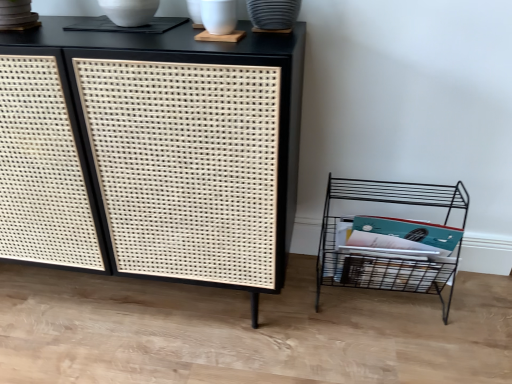
The height and width of the screenshot is (384, 512). What do you see at coordinates (381, 257) in the screenshot?
I see `black wire shelf at lower right` at bounding box center [381, 257].

Identify the location of black wire shelf at lower right. (381, 257).

Describe the element at coordinates (185, 148) in the screenshot. I see `black woven cabinet at center` at that location.

Identify the location of black woven cabinet at center. The height and width of the screenshot is (384, 512). (185, 148).

In order to click on black wire shelf at lower right in this screenshot , I will do `click(381, 257)`.

Which object is positioned more to the left, black woven cabinet at center or black wire shelf at lower right?

From the viewer's perspective, black woven cabinet at center appears more on the left side.

Is black woven cabinet at center further to the viewer compared to black wire shelf at lower right?

No, the depth of black woven cabinet at center is less than that of black wire shelf at lower right.

Is point (247, 279) closer to viewer compared to point (331, 272)?

Yes.

From the image's perspective, is black woven cabinet at center above black wire shelf at lower right?

Yes, from the image's perspective, black woven cabinet at center is over black wire shelf at lower right.

From a real-world perspective, is black woven cabinet at center under black wire shelf at lower right?

No, from a real-world perspective, black woven cabinet at center is not under black wire shelf at lower right.

Based on the photo, which object is thinner, black woven cabinet at center or black wire shelf at lower right?

With smaller width is black wire shelf at lower right.

Considering the sizes of black woven cabinet at center and black wire shelf at lower right in the image, is black woven cabinet at center taller or shorter than black wire shelf at lower right?

Clearly, black woven cabinet at center is taller compared to black wire shelf at lower right.

Considering the sizes of objects black woven cabinet at center and black wire shelf at lower right in the image provided, who is bigger, black woven cabinet at center or black wire shelf at lower right?

black woven cabinet at center is bigger.

Is black woven cabinet at center spatially inside black wire shelf at lower right, or outside of it?

black woven cabinet at center cannot be found inside black wire shelf at lower right.

Can you see black woven cabinet at center touching black wire shelf at lower right?

No, black woven cabinet at center is not next to black wire shelf at lower right.

Is black woven cabinet at center facing towards black wire shelf at lower right?

No, black woven cabinet at center is not turned towards black wire shelf at lower right.

Measure the distance from black woven cabinet at center to black wire shelf at lower right.

The distance of black woven cabinet at center from black wire shelf at lower right is 19.83 inches.

At what (x,y) coordinates should I click in order to perform the action: click on shelf that is behind the black woven cabinet at center. Please return your answer as a coordinate pair (x, y). The image size is (512, 384). Looking at the image, I should click on pyautogui.click(x=381, y=257).

Is black wire shelf at lower right at the right side of black woven cabinet at center?

Yes.

Considering the positions of objects black wire shelf at lower right and black woven cabinet at center in the image provided, who is in front, black wire shelf at lower right or black woven cabinet at center?

black woven cabinet at center.

Considering the points (360, 192) and (255, 133), which point is in front, point (360, 192) or point (255, 133)?

The point (255, 133) is closer.

From the image's perspective, which object appears higher, black wire shelf at lower right or black woven cabinet at center?

black woven cabinet at center.

From a real-world perspective, is black wire shelf at lower right located higher than black woven cabinet at center?

No, from a real-world perspective, black wire shelf at lower right is not above black woven cabinet at center.

Can you confirm if black wire shelf at lower right is thinner than black woven cabinet at center?

Indeed, black wire shelf at lower right has a lesser width compared to black woven cabinet at center.

Is black wire shelf at lower right shorter than black woven cabinet at center?

Yes, black wire shelf at lower right is shorter than black woven cabinet at center.

Looking at this image, does black wire shelf at lower right have a smaller size compared to black woven cabinet at center?

Indeed, black wire shelf at lower right has a smaller size compared to black woven cabinet at center.

Is black wire shelf at lower right completely or partially outside of black woven cabinet at center?

Yes, black wire shelf at lower right is not within black woven cabinet at center.

Would you consider black wire shelf at lower right to be distant from black woven cabinet at center?

black wire shelf at lower right is actually quite close to black woven cabinet at center.

Could you tell me if black wire shelf at lower right is facing black woven cabinet at center?

No, black wire shelf at lower right is not turned towards black woven cabinet at center.

You are a GUI agent. You are given a task and a screenshot of the screen. Output one action in this format:
    pyautogui.click(x=<x>, y=<y>)
    Task: Click on the furniture that appears above the black wire shelf at lower right (from a real-world perspective)
    The image size is (512, 384).
    Given the screenshot: What is the action you would take?
    pyautogui.click(x=185, y=148)

This screenshot has height=384, width=512. In order to click on furniture above the black wire shelf at lower right (from the image's perspective) in this screenshot , I will do `click(185, 148)`.

I want to click on furniture in front of the black wire shelf at lower right, so click(x=185, y=148).